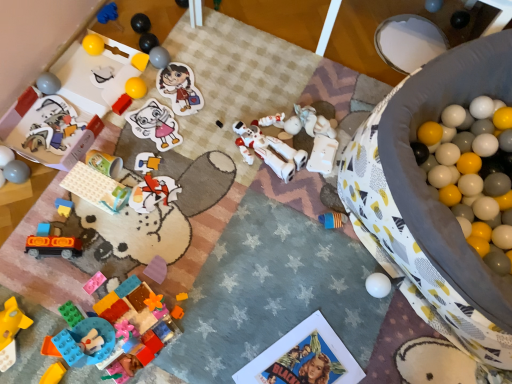
Question: Is matte plastic toy car at lower left, which is the eleventh toy from top to bottom, positioned before shiny metallic ball at upper center, acting as the third toy starting from the top?

Choices:
 (A) yes
 (B) no

Answer: (A)

Question: Does matte plastic toy car at lower left, the eighth toy in the bottom-to-top sequence, have a lesser width compared to shiny metallic ball at upper center, arranged as the sixteenth toy when ordered from the bottom?

Choices:
 (A) no
 (B) yes

Answer: (A)

Question: Is matte plastic toy car at lower left, which is the eleventh toy from top to bottom, taller than shiny metallic ball at upper center, acting as the third toy starting from the top?

Choices:
 (A) no
 (B) yes

Answer: (A)

Question: Would you say matte plastic toy car at lower left, the eighth toy in the bottom-to-top sequence, is outside shiny metallic ball at upper center, acting as the third toy starting from the top?

Choices:
 (A) yes
 (B) no

Answer: (A)

Question: Is matte plastic toy car at lower left, which is the eleventh toy from top to bottom, to the left of shiny metallic ball at upper center, acting as the third toy starting from the top, from the viewer's perspective?

Choices:
 (A) no
 (B) yes

Answer: (B)

Question: In terms of height, does matte paper sticker at upper center look taller or shorter compared to orange matte car at lower left, which is counted as the 16th toy, starting from the top?

Choices:
 (A) tall
 (B) short

Answer: (B)

Question: From a real-world perspective, relative to orange matte car at lower left, which is counted as the 16th toy, starting from the top, is matte paper sticker at upper center vertically above or below?

Choices:
 (A) above
 (B) below

Answer: (B)

Question: In terms of size, does matte paper sticker at upper center appear bigger or smaller than orange matte car at lower left, which is counted as the 16th toy, starting from the top?

Choices:
 (A) big
 (B) small

Answer: (B)

Question: Is matte paper sticker at upper center spatially inside orange matte car at lower left, the third toy when ordered from bottom to top, or outside of it?

Choices:
 (A) outside
 (B) inside

Answer: (A)

Question: Looking at the image, does matte plastic toy at left, the twelfth toy in the bottom-to-top sequence, seem bigger or smaller compared to yellow plastic block at lower left, marked as the 18th toy in a top-to-bottom arrangement?

Choices:
 (A) small
 (B) big

Answer: (B)

Question: Would you say matte plastic toy at left, the twelfth toy in the bottom-to-top sequence, is inside or outside yellow plastic block at lower left, positioned as the 1th toy in bottom-to-top order?

Choices:
 (A) inside
 (B) outside

Answer: (B)

Question: In terms of height, does matte plastic toy at left, the twelfth toy in the bottom-to-top sequence, look taller or shorter compared to yellow plastic block at lower left, marked as the 18th toy in a top-to-bottom arrangement?

Choices:
 (A) tall
 (B) short

Answer: (B)

Question: From a real-world perspective, is matte plastic toy at left, the twelfth toy in the bottom-to-top sequence, physically located above or below yellow plastic block at lower left, positioned as the 1th toy in bottom-to-top order?

Choices:
 (A) below
 (B) above

Answer: (A)

Question: Based on their positions, is translucent plastic toy car at lower left, the 12th toy from the top, located to the left or right of rubberized blue and yellow blocks at lower left, which is counted as the thirteenth toy, starting from the top?

Choices:
 (A) right
 (B) left

Answer: (A)

Question: Considering the positions of translucent plastic toy car at lower left, positioned as the seventh toy in bottom-to-top order, and rubberized blue and yellow blocks at lower left, which is the 6th toy in bottom-to-top order, in the image, is translucent plastic toy car at lower left, positioned as the seventh toy in bottom-to-top order, taller or shorter than rubberized blue and yellow blocks at lower left, which is the 6th toy in bottom-to-top order,?

Choices:
 (A) tall
 (B) short

Answer: (A)